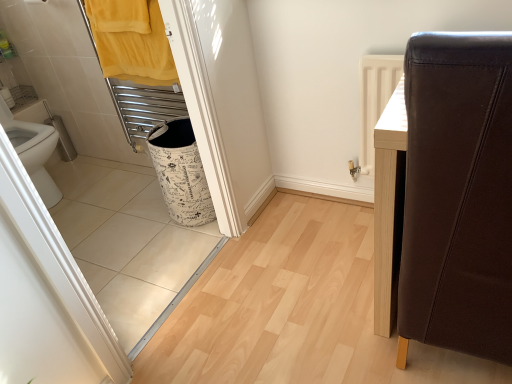
Question: Does white printed fabric laundry basket at lower left lie behind yellow fabric towel at upper left?

Choices:
 (A) yes
 (B) no

Answer: (A)

Question: Is white printed fabric laundry basket at lower left thinner than yellow fabric towel at upper left?

Choices:
 (A) yes
 (B) no

Answer: (B)

Question: Does white printed fabric laundry basket at lower left come in front of yellow fabric towel at upper left?

Choices:
 (A) yes
 (B) no

Answer: (B)

Question: Is white printed fabric laundry basket at lower left at the left side of yellow fabric towel at upper left?

Choices:
 (A) no
 (B) yes

Answer: (A)

Question: Would you say white printed fabric laundry basket at lower left is outside yellow fabric towel at upper left?

Choices:
 (A) yes
 (B) no

Answer: (A)

Question: Does point (413, 233) appear closer or farther from the camera than point (202, 185)?

Choices:
 (A) closer
 (B) farther

Answer: (A)

Question: Considering the positions of brown leather chair at right and white printed fabric laundry basket at lower left in the image, is brown leather chair at right taller or shorter than white printed fabric laundry basket at lower left?

Choices:
 (A) tall
 (B) short

Answer: (A)

Question: Relative to white printed fabric laundry basket at lower left, is brown leather chair at right in front or behind?

Choices:
 (A) behind
 (B) front

Answer: (B)

Question: Considering the positions of brown leather chair at right and white printed fabric laundry basket at lower left in the image, is brown leather chair at right wider or thinner than white printed fabric laundry basket at lower left?

Choices:
 (A) wide
 (B) thin

Answer: (A)

Question: Looking at their shapes, would you say yellow fabric towel at upper left is wider or thinner than white printed fabric laundry basket at lower left?

Choices:
 (A) thin
 (B) wide

Answer: (A)

Question: Considering the positions of yellow fabric towel at upper left and white printed fabric laundry basket at lower left in the image, is yellow fabric towel at upper left taller or shorter than white printed fabric laundry basket at lower left?

Choices:
 (A) tall
 (B) short

Answer: (B)

Question: Visually, is yellow fabric towel at upper left positioned to the left or to the right of white printed fabric laundry basket at lower left?

Choices:
 (A) left
 (B) right

Answer: (A)

Question: Based on their sizes in the image, would you say yellow fabric towel at upper left is bigger or smaller than white printed fabric laundry basket at lower left?

Choices:
 (A) small
 (B) big

Answer: (A)

Question: Is white printed fabric laundry basket at lower left situated inside yellow fabric towel at upper left or outside?

Choices:
 (A) outside
 (B) inside

Answer: (A)

Question: From the image's perspective, is white printed fabric laundry basket at lower left positioned above or below yellow fabric towel at upper left?

Choices:
 (A) above
 (B) below

Answer: (B)